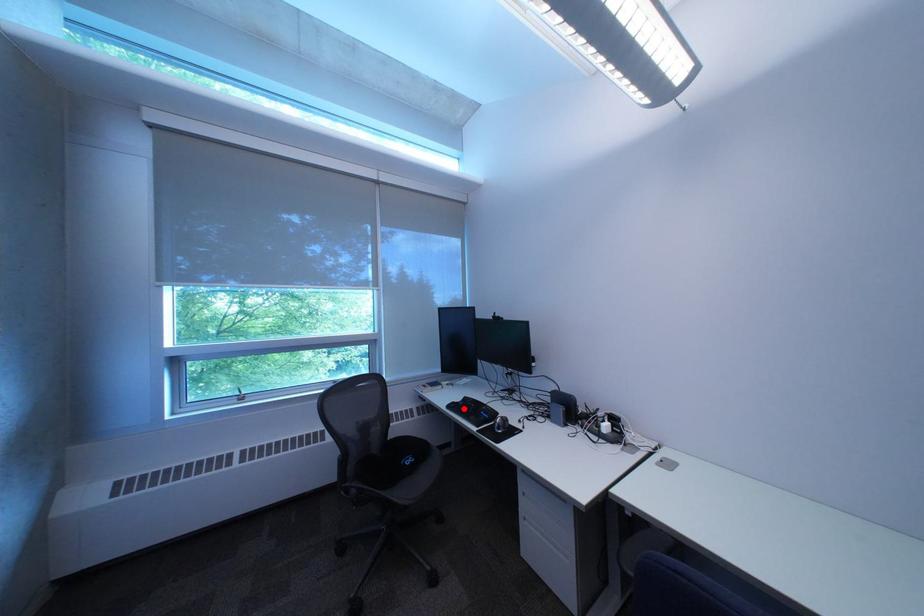
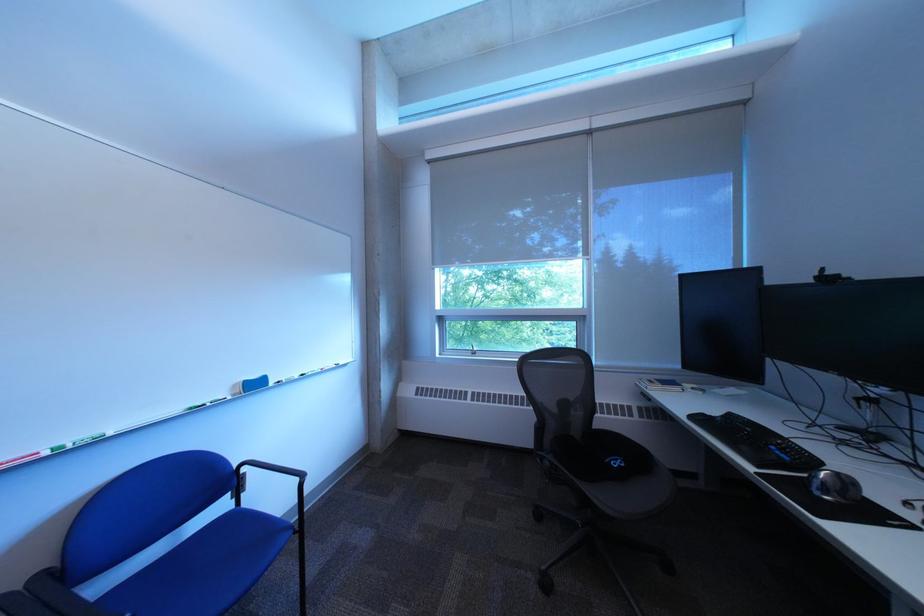
Locate, in the second image, the point that corresponds to the highlighted location in the first image.

(708, 419)